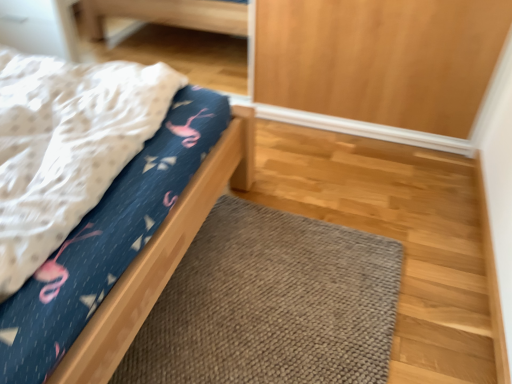
The image size is (512, 384). Identify the location of vacant point to the right of brown knitted doormat at lower center. click(433, 271).